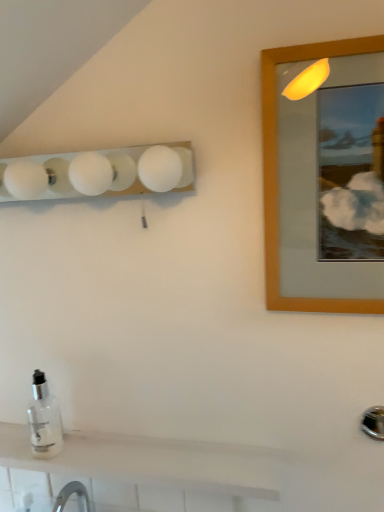
Question: From a real-world perspective, relative to clear glass bottle at lower left, is wooden-framed mirror at upper right vertically above or below?

Choices:
 (A) above
 (B) below

Answer: (A)

Question: In the image, is wooden-framed mirror at upper right on the left side or the right side of clear glass bottle at lower left?

Choices:
 (A) left
 (B) right

Answer: (B)

Question: Which object is positioned farthest from the white glossy tile at lower left?

Choices:
 (A) wooden-framed mirror at upper right
 (B) clear glass bottle at lower left
 (C) white frosted glass light fixture at upper left

Answer: (A)

Question: Based on their relative distances, which object is nearer to the wooden-framed mirror at upper right?

Choices:
 (A) white frosted glass light fixture at upper left
 (B) white glossy tile at lower left
 (C) clear glass bottle at lower left

Answer: (A)